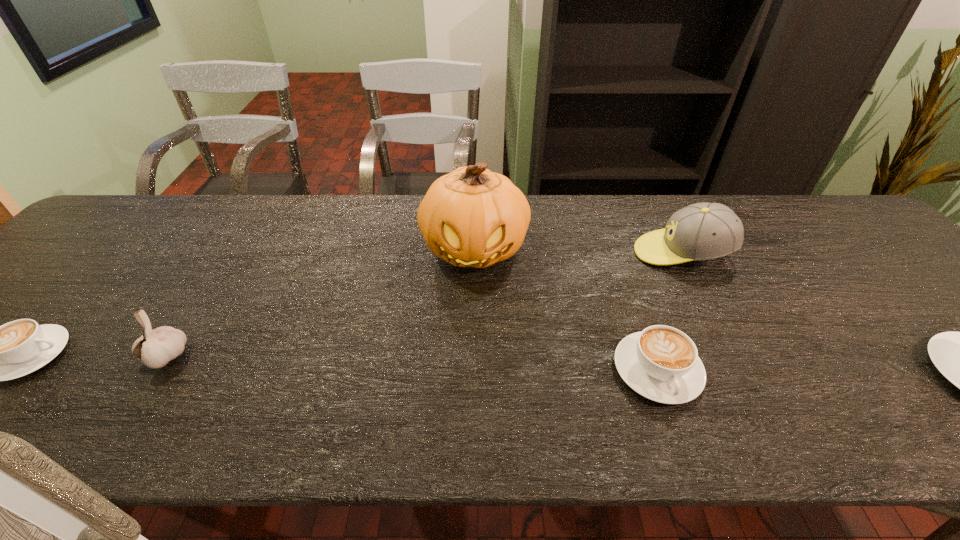
Locate an element on the screen. This screenshot has height=540, width=960. vacant space situated on the front-facing side of the fifth shortest object is located at coordinates (516, 253).

This screenshot has height=540, width=960. What are the coordinates of `blank area located on the front-facing side of the fifth shortest object` in the screenshot? It's located at (553, 253).

Locate an element on the screen. The width and height of the screenshot is (960, 540). pumpkin at the far edge is located at coordinates (472, 217).

At what (x,y) coordinates should I click in order to perform the action: click on baseball cap that is at the far edge. Please return your answer as a coordinate pair (x, y). Looking at the image, I should click on (703, 231).

The image size is (960, 540). In order to click on cappuccino that is at the near edge in this screenshot , I will do `click(661, 363)`.

What are the coordinates of `garlic that is positioned at the near edge` in the screenshot? It's located at (156, 347).

At what (x,y) coordinates should I click in order to perform the action: click on free space at the far edge of the desktop. Please return your answer as a coordinate pair (x, y). The image size is (960, 540). Looking at the image, I should click on (574, 233).

Identify the location of vacant space at the near edge of the desktop. The width and height of the screenshot is (960, 540). (517, 387).

Find the location of a particular element. This screenshot has height=540, width=960. free space at the left edge is located at coordinates (84, 298).

The height and width of the screenshot is (540, 960). In the image, there is a desktop. Identify the location of vacant space at the right edge. (903, 314).